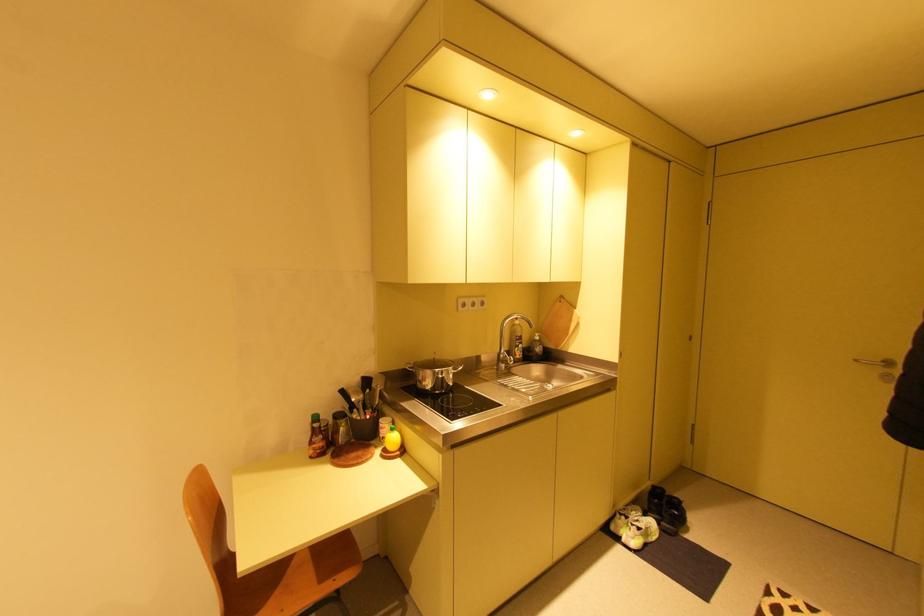
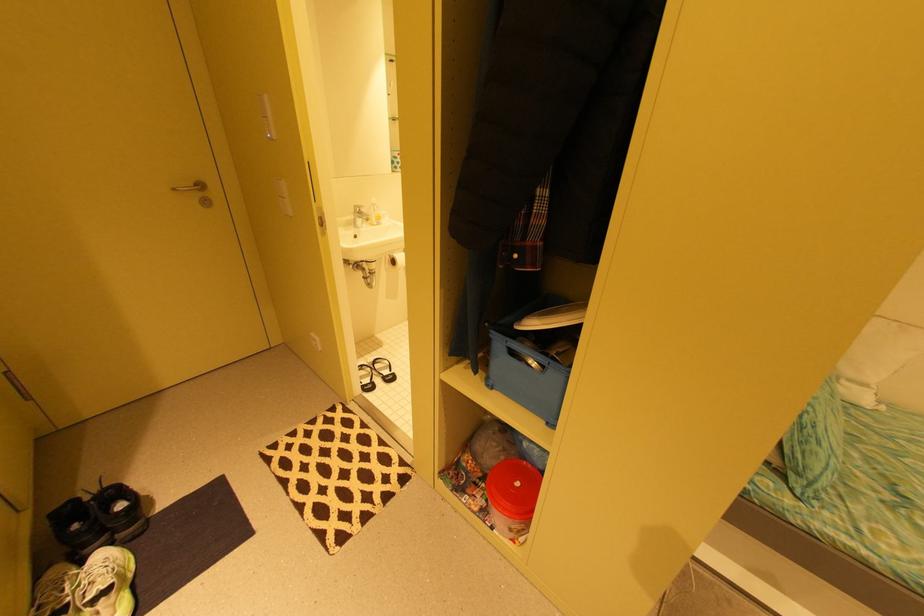
Where in the second image is the point corresponding to pixel 650 515 from the first image?

(90, 562)